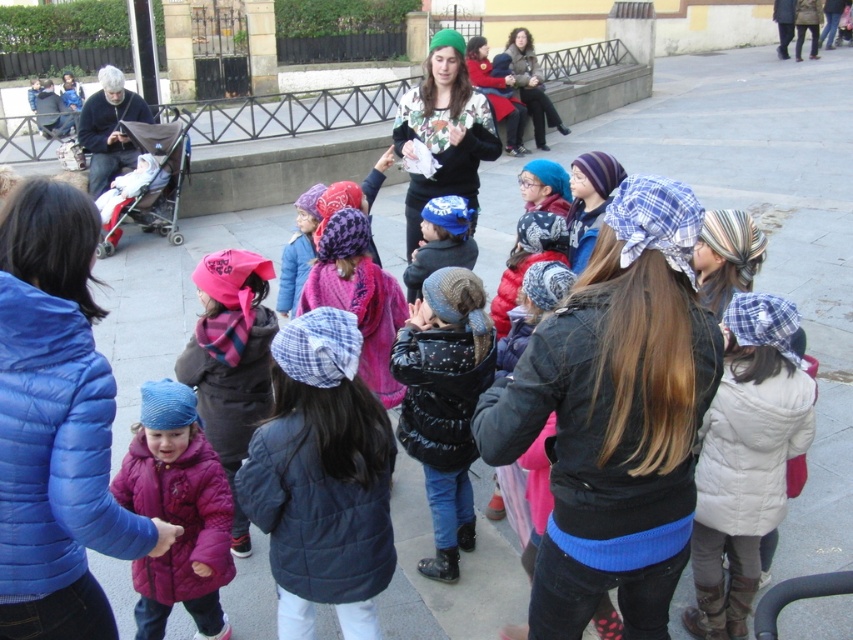
Is matte pink coat at center below matte black jacket at left?

Yes.

Can you confirm if matte pink coat at center is positioned above matte black jacket at left?

No, matte pink coat at center is not above matte black jacket at left.

Does point (144, 600) come behind point (119, 109)?

No, (144, 600) is in front of (119, 109).

Image resolution: width=853 pixels, height=640 pixels. Find the location of `matte pink coat at center`. matte pink coat at center is located at coordinates (177, 513).

Which is in front, point (421, 381) or point (82, 122)?

Point (421, 381) is more forward.

Is point (459, 289) behind point (122, 116)?

No, it is not.

Where is `black puffy jacket at center`? black puffy jacket at center is located at coordinates (444, 403).

Can you confirm if white puffy coat at center is positioned below black puffy jacket at center?

Indeed, white puffy coat at center is positioned under black puffy jacket at center.

In the scene shown: Between white puffy coat at center and black puffy jacket at center, which one has less height?

Standing shorter between the two is black puffy jacket at center.

Find the location of a particular element. Image resolution: width=853 pixels, height=640 pixels. white puffy coat at center is located at coordinates (746, 458).